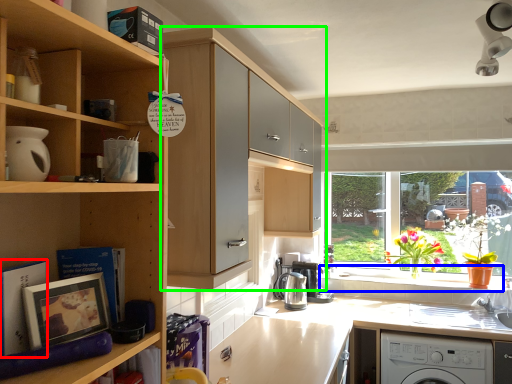
Question: Which object is the farthest from book (highlighted by a red box)? Choose among these: window sill (highlighted by a blue box) or cabinetry (highlighted by a green box).

Choices:
 (A) window sill
 (B) cabinetry

Answer: (A)